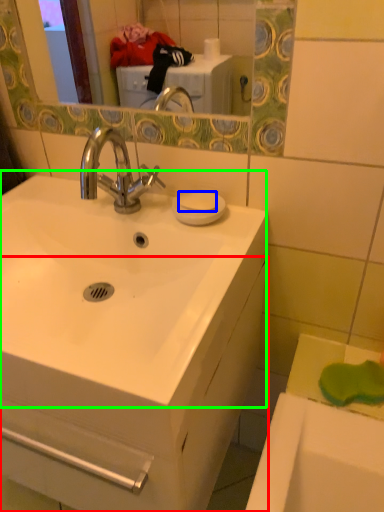
Question: Which object is positioned closest to bathroom cabinet (highlighted by a red box)? Select from soap (highlighted by a blue box) and sink (highlighted by a green box).

Choices:
 (A) soap
 (B) sink

Answer: (B)